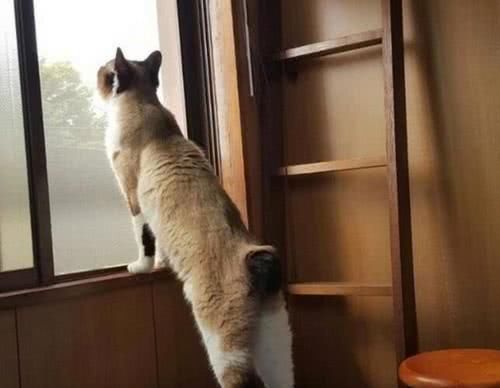
Where is `brown wood panel walls`? This screenshot has width=500, height=388. brown wood panel walls is located at coordinates (450, 148), (105, 338).